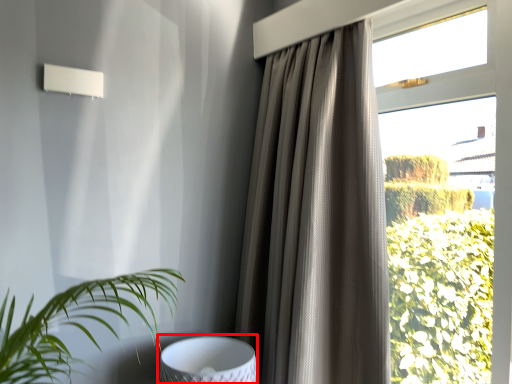
Question: From the image's perspective, where is swivel chair (annotated by the red box) located in relation to curtain in the image?

Choices:
 (A) below
 (B) above

Answer: (A)